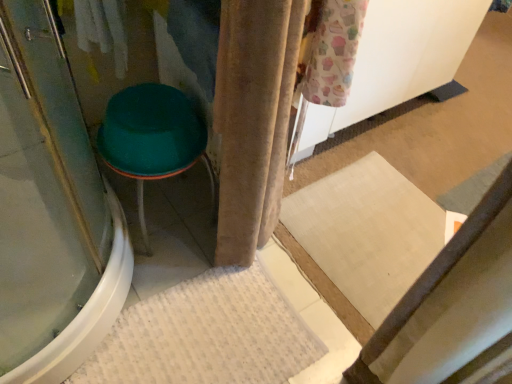
Question: From a real-world perspective, is white textured bath mat at lower center over transparent glass screen door at left?

Choices:
 (A) no
 (B) yes

Answer: (A)

Question: Is transparent glass screen door at left at the back of white textured bath mat at lower center?

Choices:
 (A) no
 (B) yes

Answer: (A)

Question: Is white textured bath mat at lower center to the right of transparent glass screen door at left from the viewer's perspective?

Choices:
 (A) no
 (B) yes

Answer: (B)

Question: Is white textured bath mat at lower center to the left of transparent glass screen door at left from the viewer's perspective?

Choices:
 (A) yes
 (B) no

Answer: (B)

Question: Considering the relative sizes of white textured bath mat at lower center and transparent glass screen door at left in the image provided, is white textured bath mat at lower center thinner than transparent glass screen door at left?

Choices:
 (A) no
 (B) yes

Answer: (B)

Question: Based on their positions, is white textured bath mat at lower center located to the left or right of beige velvet curtain at center?

Choices:
 (A) right
 (B) left

Answer: (B)

Question: Considering the positions of point (162, 354) and point (245, 6), is point (162, 354) closer or farther from the camera than point (245, 6)?

Choices:
 (A) closer
 (B) farther

Answer: (B)

Question: In terms of height, does white textured bath mat at lower center look taller or shorter compared to beige velvet curtain at center?

Choices:
 (A) tall
 (B) short

Answer: (B)

Question: Is white textured bath mat at lower center inside or outside of beige velvet curtain at center?

Choices:
 (A) outside
 (B) inside

Answer: (A)

Question: Looking at their shapes, would you say green plastic stool at left is wider or thinner than white textured bath mat at lower center?

Choices:
 (A) wide
 (B) thin

Answer: (B)

Question: From their relative heights in the image, would you say green plastic stool at left is taller or shorter than white textured bath mat at lower center?

Choices:
 (A) tall
 (B) short

Answer: (A)

Question: From a real-world perspective, is green plastic stool at left physically located above or below white textured bath mat at lower center?

Choices:
 (A) below
 (B) above

Answer: (B)

Question: Considering the relative positions of green plastic stool at left and white textured bath mat at lower center in the image provided, is green plastic stool at left to the left or to the right of white textured bath mat at lower center?

Choices:
 (A) right
 (B) left

Answer: (B)

Question: Is beige velvet curtain at center inside the boundaries of white textured bath mat at lower center, or outside?

Choices:
 (A) outside
 (B) inside

Answer: (A)

Question: From the image's perspective, is beige velvet curtain at center above or below white textured bath mat at lower center?

Choices:
 (A) below
 (B) above

Answer: (B)